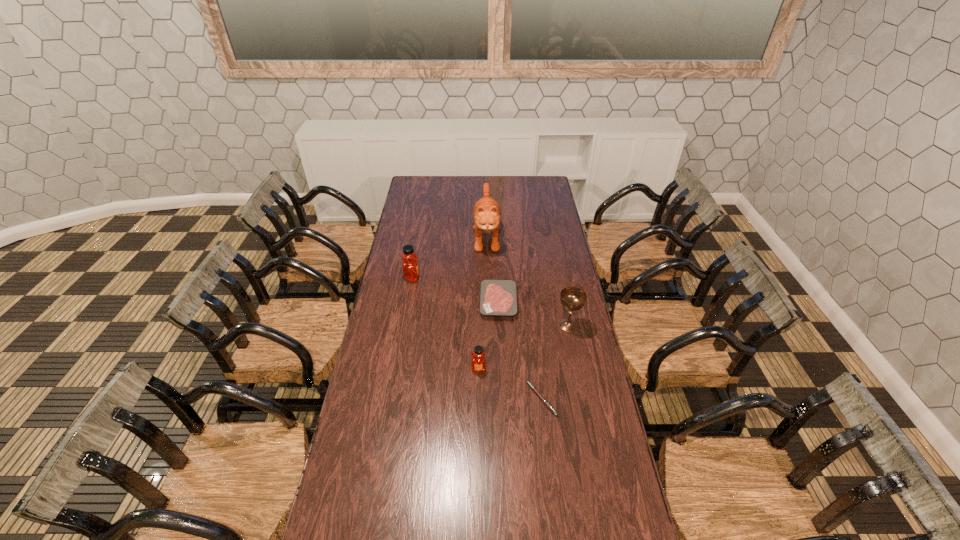
The height and width of the screenshot is (540, 960). In order to click on the taller honey in this screenshot , I will do `click(410, 268)`.

Locate an element on the screen. This screenshot has width=960, height=540. the second farthest object is located at coordinates tap(410, 268).

You are a GUI agent. You are given a task and a screenshot of the screen. Output one action in this format:
    pyautogui.click(x=<x>, y=<y>)
    Task: Click on the nearer honey
    Image resolution: width=960 pixels, height=540 pixels.
    Given the screenshot: What is the action you would take?
    pyautogui.click(x=478, y=363)

Identify the location of the shorter honey. (478, 363).

I want to click on the second shortest object, so click(498, 297).

At what (x,y) coordinates should I click in order to perform the action: click on cat. Please return your answer as a coordinate pair (x, y). Looking at the image, I should click on (486, 213).

Identify the location of the tallest object. click(486, 213).

Identify the location of the shortest object. This screenshot has height=540, width=960. (533, 388).

Where is `the second object from right to left`? Image resolution: width=960 pixels, height=540 pixels. the second object from right to left is located at coordinates [x=533, y=388].

Where is `the rightmost object`? The height and width of the screenshot is (540, 960). the rightmost object is located at coordinates (572, 298).